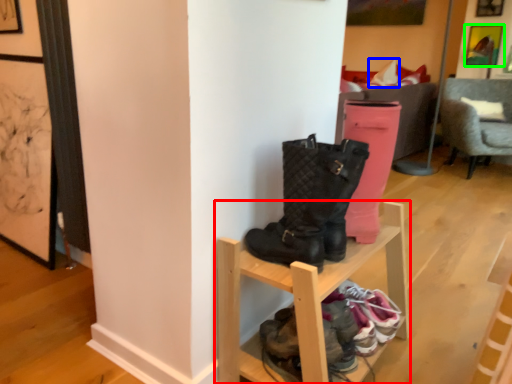
Question: Estimate the real-world distances between objects in this image. Which object is farther from shelf (highlighted by a red box), pillow (highlighted by a blue box) or picture frame (highlighted by a green box)?

Choices:
 (A) pillow
 (B) picture frame

Answer: (B)